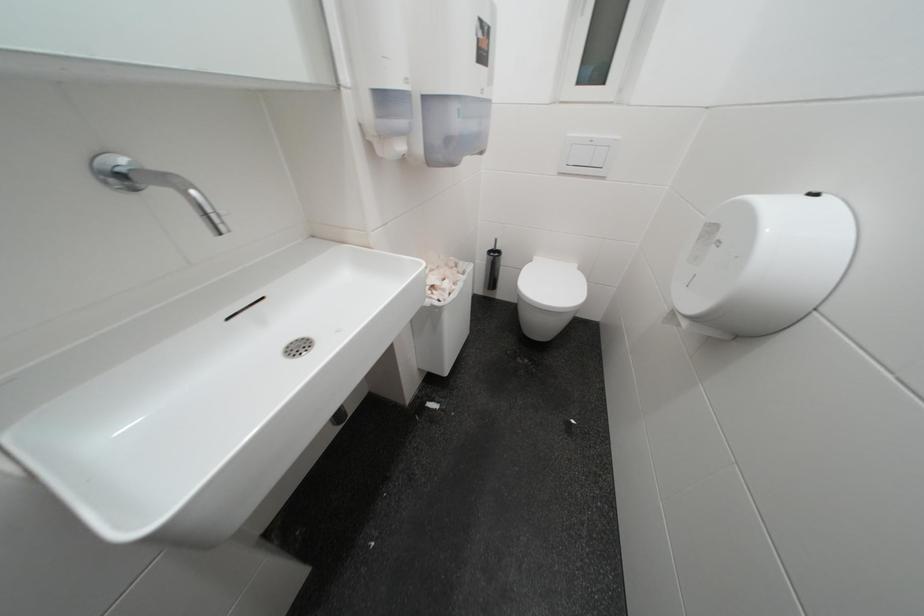
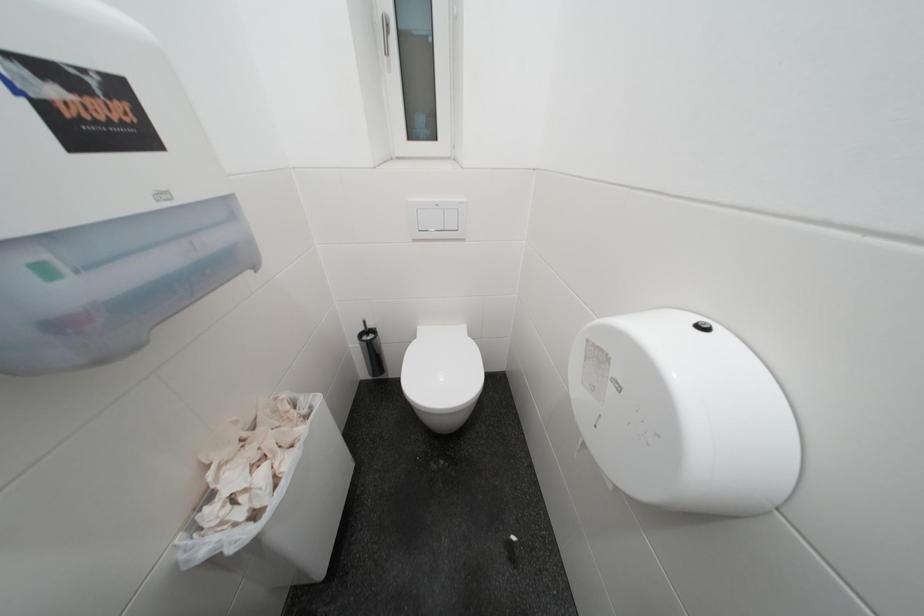
The images are taken continuously from a first-person perspective. In which direction are you moving?

The cameraman walked toward right, forward.